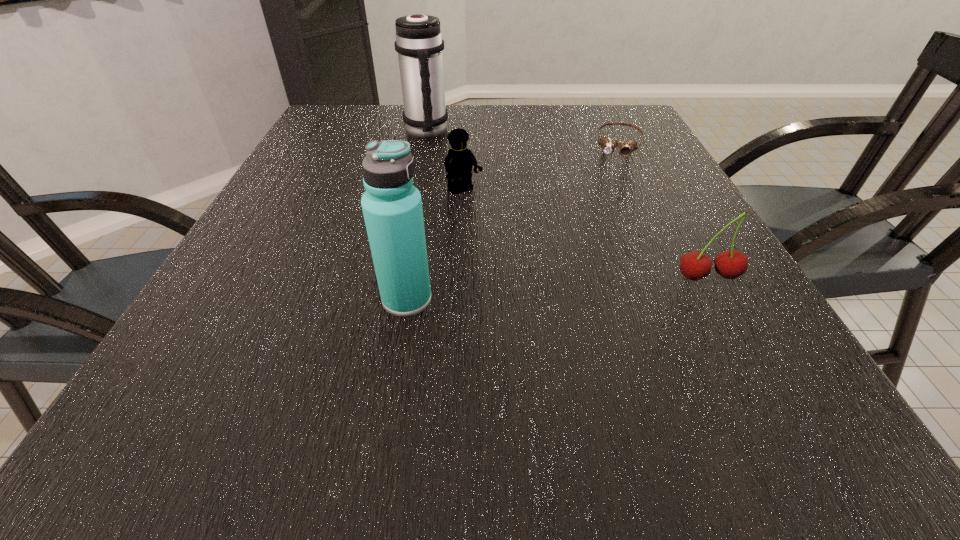
The width and height of the screenshot is (960, 540). I want to click on free spot between the Lego and the shortest object, so click(541, 167).

Locate an element on the screen. Image resolution: width=960 pixels, height=540 pixels. vacant point located between the Lego and the cherry is located at coordinates (586, 234).

Identify the location of vacant region between the farther thermos bottle and the shortest object. The width and height of the screenshot is (960, 540). (523, 138).

Find the location of a particular element. vacant space that is in between the cherry and the Lego is located at coordinates (586, 234).

The image size is (960, 540). What are the coordinates of `free space that is in between the shortest object and the cherry` in the screenshot? It's located at (663, 210).

This screenshot has width=960, height=540. In order to click on free point between the farther thermos bottle and the cherry in this screenshot , I will do `click(567, 205)`.

This screenshot has width=960, height=540. Find the location of `free point between the goggles and the farther thermos bottle`. free point between the goggles and the farther thermos bottle is located at coordinates (x=523, y=138).

Find the location of a particular element. This screenshot has width=960, height=540. the fourth closest object relative to the nearer thermos bottle is located at coordinates (607, 144).

Locate an element on the screen. The width and height of the screenshot is (960, 540). object identified as the third closest to the nearer thermos bottle is located at coordinates (419, 43).

This screenshot has height=540, width=960. I want to click on vacant region that satisfies the following two spatial constraints: 1. on the back side of the nearer thermos bottle; 2. on the left side of the shortest object, so click(433, 143).